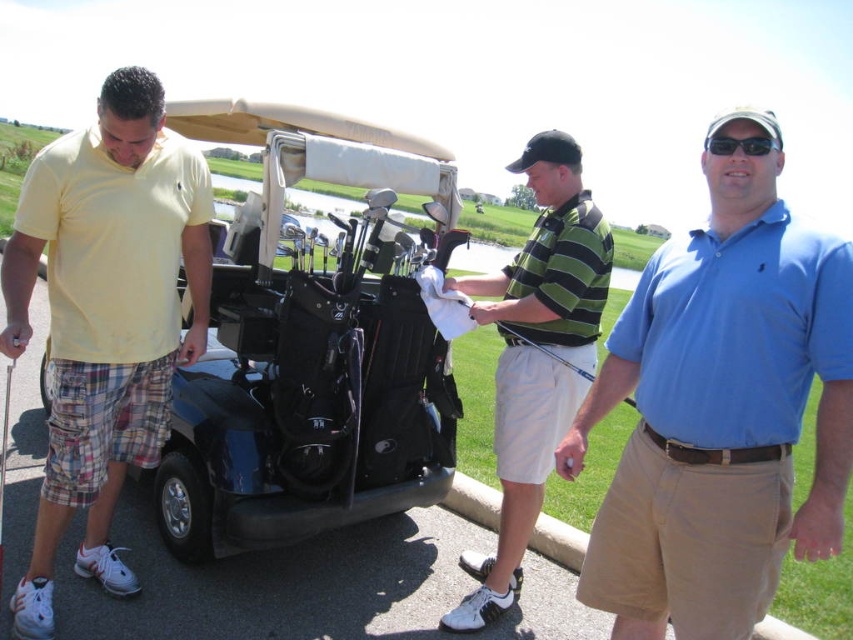
What do you see at coordinates (312, 344) in the screenshot? The image size is (853, 640). I see `black matte golf cart at left` at bounding box center [312, 344].

The width and height of the screenshot is (853, 640). What are the coordinates of `black matte golf cart at left` in the screenshot? It's located at (312, 344).

At what (x,y) coordinates should I click in order to perform the action: click on black matte golf cart at left. Please return your answer as a coordinate pair (x, y). The height and width of the screenshot is (640, 853). Looking at the image, I should click on (312, 344).

Is yellow cotton polo shirt at left to the right of striped polo shirt at center from the viewer's perspective?

Incorrect, yellow cotton polo shirt at left is not on the right side of striped polo shirt at center.

Find the location of a particular element. This screenshot has width=853, height=640. yellow cotton polo shirt at left is located at coordinates (105, 316).

Does point (767, 216) lie in front of point (697, 362)?

Yes, it is in front of point (697, 362).

Is the position of blue cotton polo shirt at center more distant than that of blue cotton polo shirt at right?

No.

At what (x,y) coordinates should I click in order to perform the action: click on blue cotton polo shirt at center. Please return your answer as a coordinate pair (x, y). The image size is (853, 640). Looking at the image, I should click on (720, 410).